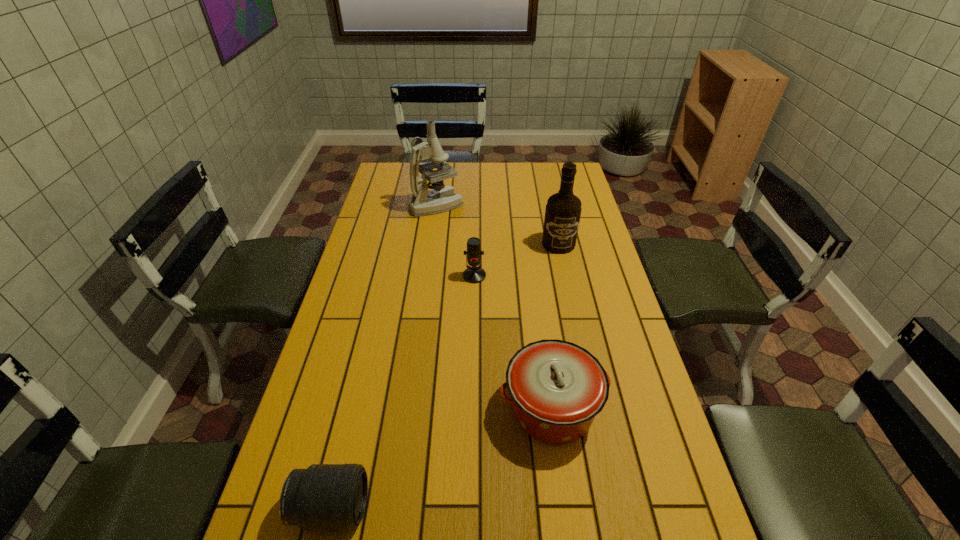
Identify the location of the farthest object. This screenshot has height=540, width=960. click(x=442, y=198).

This screenshot has width=960, height=540. What are the coordinates of `alcohol` in the screenshot? It's located at (563, 210).

Locate an element on the screen. The height and width of the screenshot is (540, 960). casserole is located at coordinates (557, 388).

The height and width of the screenshot is (540, 960). What are the coordinates of `the third farthest object` in the screenshot? It's located at (473, 274).

Locate an element on the screen. This screenshot has width=960, height=540. the third object from left to right is located at coordinates (473, 274).

This screenshot has width=960, height=540. In order to click on free space located 0.070m on the left of the microscope in this screenshot , I will do `click(392, 205)`.

Identify the location of free region located 0.070m on the label of the alcohol. (564, 267).

The height and width of the screenshot is (540, 960). I want to click on vacant space located 0.130m on the back of the casserole, so click(x=541, y=332).

Where is `vacant space located 0.300m on the side of the microphone with the red ring`? Image resolution: width=960 pixels, height=540 pixels. vacant space located 0.300m on the side of the microphone with the red ring is located at coordinates (473, 356).

This screenshot has height=540, width=960. What are the coordinates of `object that is positioned at the left edge` in the screenshot? It's located at (442, 198).